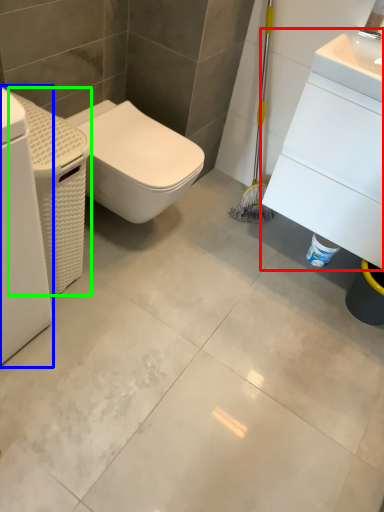
Question: Which is farther away from porcelain (highlighted by a red box)? washing machine (highlighted by a blue box) or porcelain (highlighted by a green box)?

Choices:
 (A) washing machine
 (B) porcelain

Answer: (A)